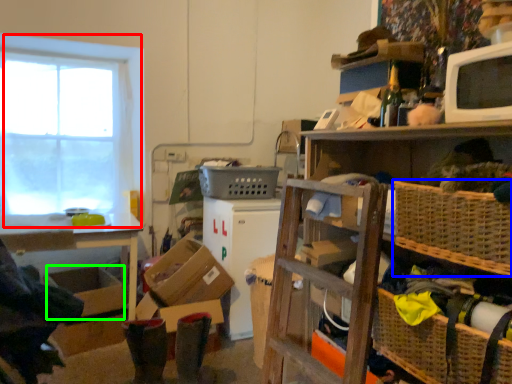
Question: Which is nearer to the window (highlighted by a red box)? basket (highlighted by a blue box) or storage box (highlighted by a green box).

Choices:
 (A) basket
 (B) storage box

Answer: (B)